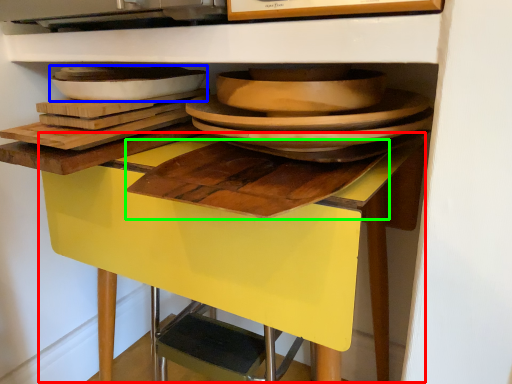
Question: Considering the real-world distances, which object is farthest from table (highlighted by a red box)? platter (highlighted by a blue box) or cutting board (highlighted by a green box)?

Choices:
 (A) platter
 (B) cutting board

Answer: (A)